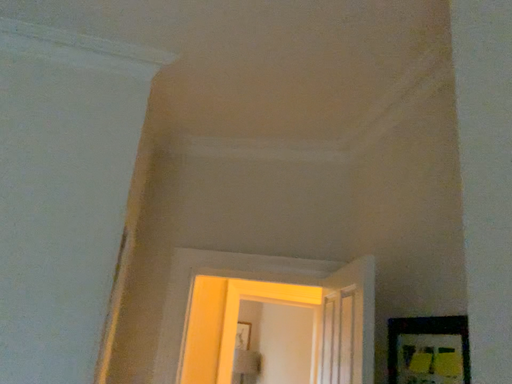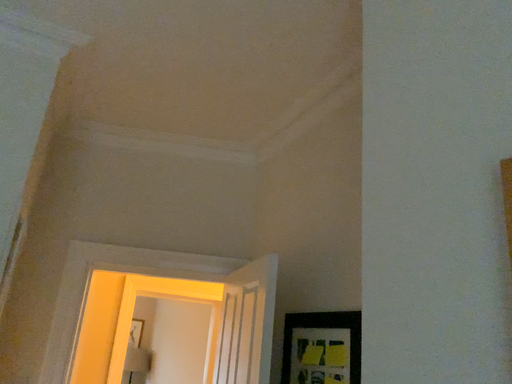
Question: How did the camera likely rotate when shooting the video?

Choices:
 (A) rotated left
 (B) rotated right

Answer: (B)